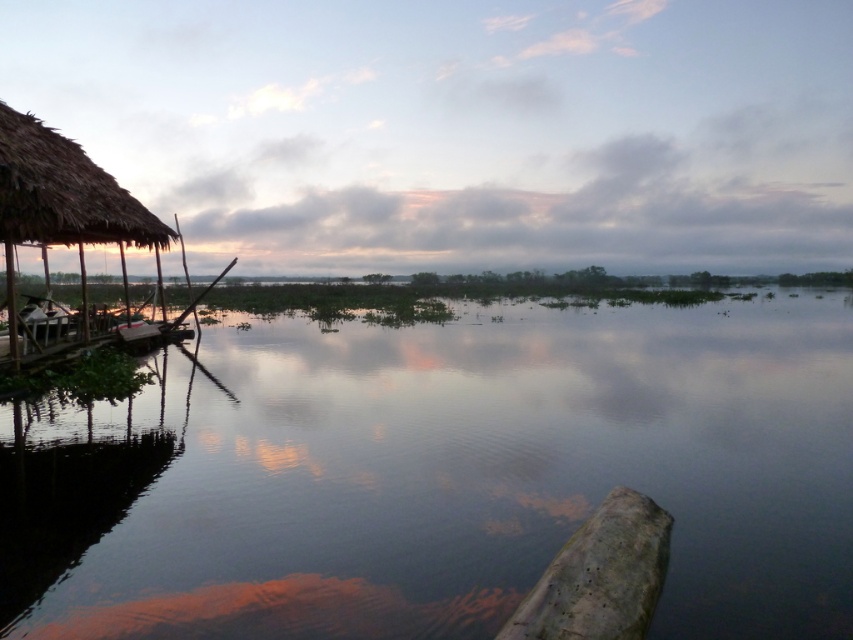
Question: From the image, what is the correct spatial relationship of transparent water at center in relation to thatched straw hut at left?

Choices:
 (A) below
 (B) above

Answer: (A)

Question: Which object is farther from the camera taking this photo?

Choices:
 (A) transparent water at center
 (B) thatched straw hut at left

Answer: (B)

Question: Is transparent water at center to the left of thatched straw hut at left from the viewer's perspective?

Choices:
 (A) no
 (B) yes

Answer: (A)

Question: Where is transparent water at center located in relation to thatched straw hut at left in the image?

Choices:
 (A) above
 (B) below

Answer: (B)

Question: Which point is farther from the camera taking this photo?

Choices:
 (A) (12, 161)
 (B) (689, 561)

Answer: (A)